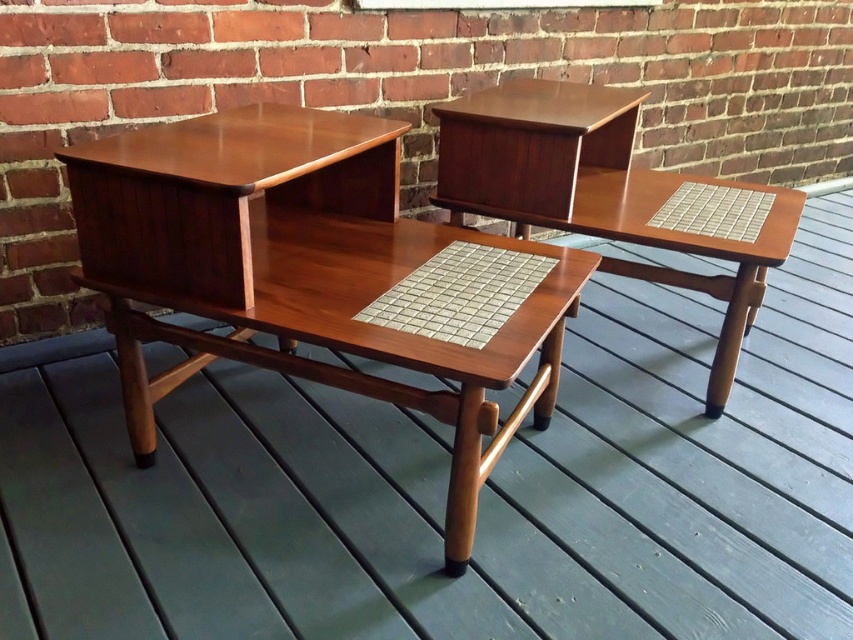
Question: Can you confirm if wooden/matte desk at center is bigger than wooden tile desk at center?

Choices:
 (A) yes
 (B) no

Answer: (B)

Question: Is wooden/matte desk at center behind wooden tile desk at center?

Choices:
 (A) no
 (B) yes

Answer: (A)

Question: Which of the following is the farthest from the observer?

Choices:
 (A) (126, 147)
 (B) (610, 145)

Answer: (B)

Question: Which object appears farthest from the camera in this image?

Choices:
 (A) wooden/matte desk at center
 (B) wooden tile desk at center

Answer: (B)

Question: Observing the image, what is the correct spatial positioning of wooden/matte desk at center in reference to wooden tile desk at center?

Choices:
 (A) below
 (B) above

Answer: (A)